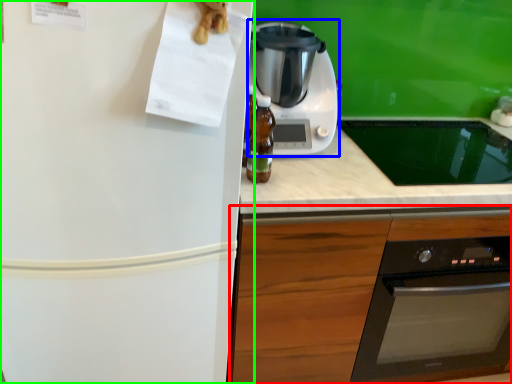
Question: Which object is positioned farthest from cabinetry (highlighted by a red box)? Select from kitchen appliance (highlighted by a blue box) and refrigerator (highlighted by a green box).

Choices:
 (A) kitchen appliance
 (B) refrigerator

Answer: (A)